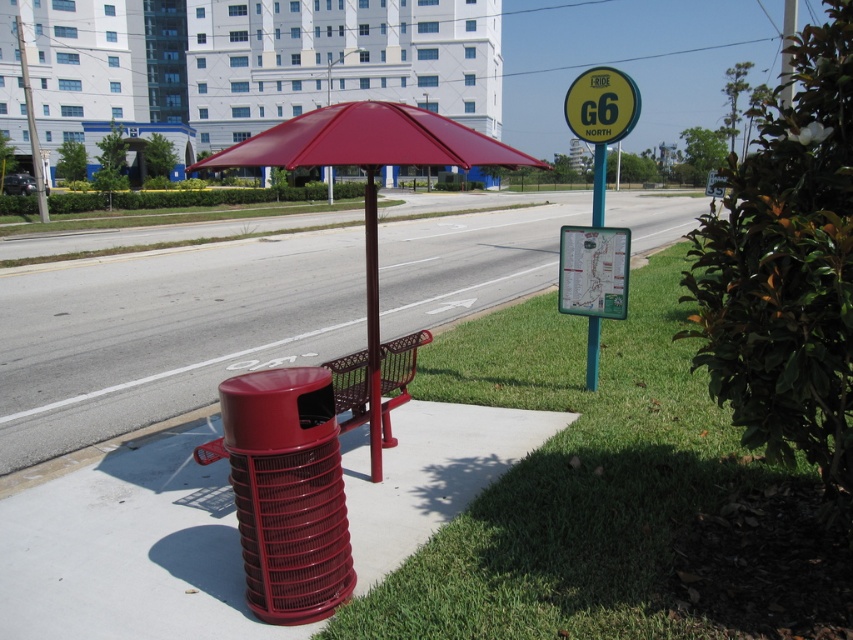
Who is more forward, [608,564] or [606,244]?

Point [608,564] is in front.

Can you confirm if green grass at lower right is wider than green plastic map at right?

Incorrect, green grass at lower right's width does not surpass green plastic map at right's.

This screenshot has width=853, height=640. In order to click on green grass at lower right in this screenshot , I will do `click(614, 499)`.

Between green grass at lower right and glossy plastic trash can at lower left, which one has more height?

With more height is glossy plastic trash can at lower left.

Between point (456, 397) and point (380, 252), which one is positioned behind?

Positioned behind is point (380, 252).

Does point (514, 588) come behind point (463, 282)?

That is False.

Where is `green grass at lower right`? This screenshot has width=853, height=640. green grass at lower right is located at coordinates (614, 499).

Does green plastic map at right have a lesser height compared to yellow-green plastic sign at upper right?

Yes, green plastic map at right is shorter than yellow-green plastic sign at upper right.

This screenshot has height=640, width=853. Identify the location of green plastic map at right. (593, 269).

Between point (612, 317) and point (595, 81), which one is positioned in front?

Positioned in front is point (595, 81).

Image resolution: width=853 pixels, height=640 pixels. I want to click on green plastic map at right, so click(593, 269).